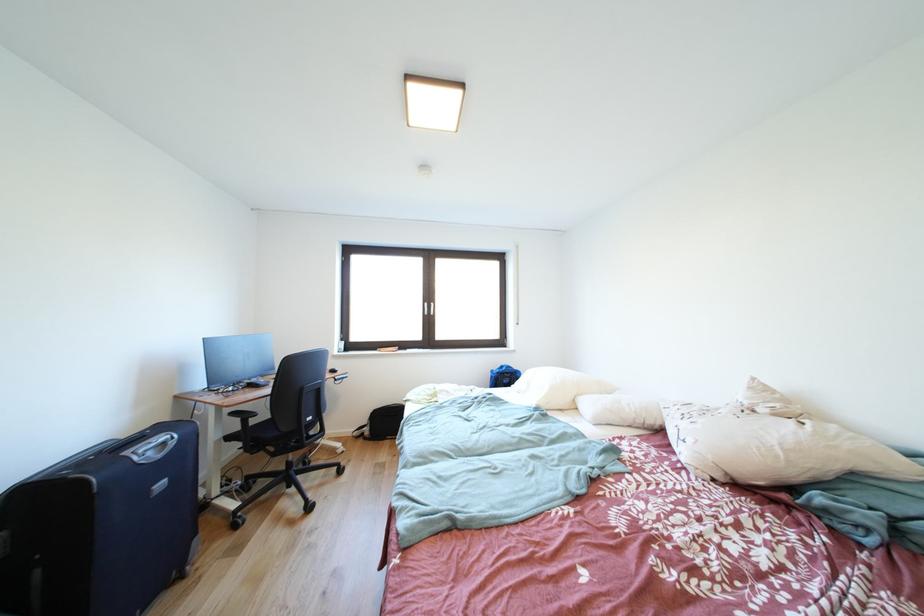
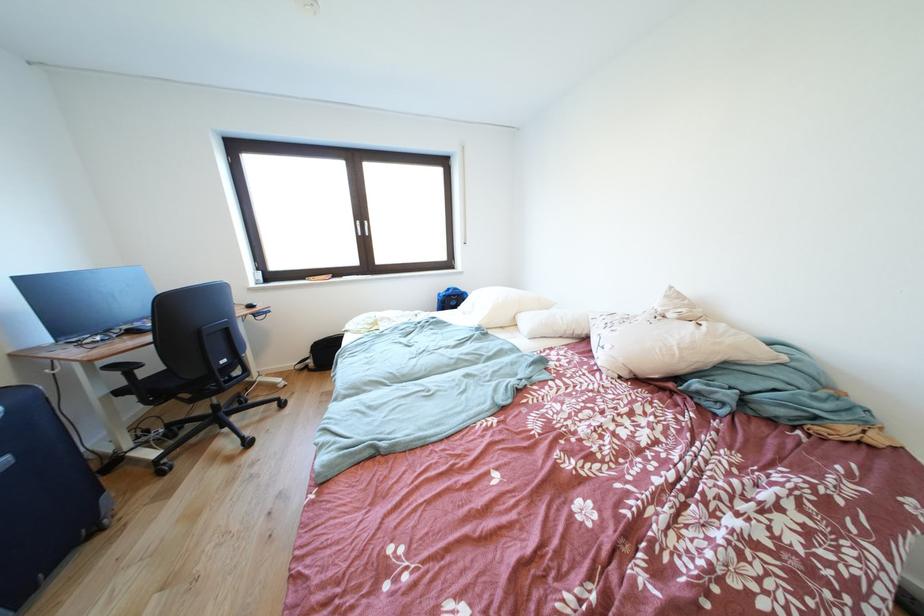
In a continuous first-person perspective shot, in which direction is the camera moving?

The cameraman moved toward right, forward.